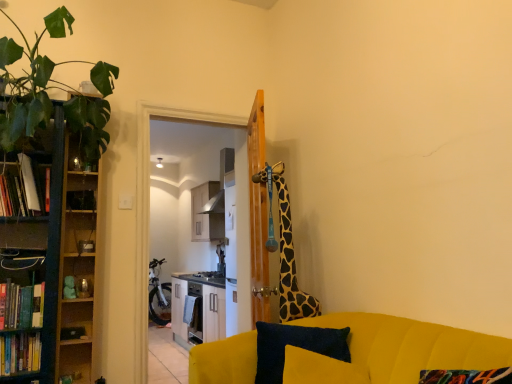
Question: Is wooden shelf at left next to hardcover book at left, the second book positioned from the bottom?

Choices:
 (A) no
 (B) yes

Answer: (A)

Question: Is there a large distance between wooden shelf at left and hardcover book at left, the 2th book positioned from the top?

Choices:
 (A) no
 (B) yes

Answer: (A)

Question: Is wooden shelf at left bigger than hardcover book at left, the 2th book positioned from the top?

Choices:
 (A) yes
 (B) no

Answer: (A)

Question: Is wooden shelf at left thinner than hardcover book at left, the 2th book positioned from the top?

Choices:
 (A) yes
 (B) no

Answer: (A)

Question: Is wooden shelf at left facing away from hardcover book at left, the 2th book positioned from the top?

Choices:
 (A) no
 (B) yes

Answer: (A)

Question: From the image's perspective, relative to hardcover book at left, the 2th book positioned from the top, is velvet dark blue pillow at lower center above or below?

Choices:
 (A) below
 (B) above

Answer: (A)

Question: Based on their sizes in the image, would you say velvet dark blue pillow at lower center is bigger or smaller than hardcover book at left, the 2th book positioned from the top?

Choices:
 (A) big
 (B) small

Answer: (A)

Question: Considering the positions of velvet dark blue pillow at lower center and hardcover book at left, the 2th book positioned from the top, in the image, is velvet dark blue pillow at lower center taller or shorter than hardcover book at left, the 2th book positioned from the top,?

Choices:
 (A) short
 (B) tall

Answer: (A)

Question: In the image, is velvet dark blue pillow at lower center positioned in front of or behind hardcover book at left, the 2th book positioned from the top?

Choices:
 (A) behind
 (B) front

Answer: (B)

Question: In terms of height, does white glossy cabinet at center look taller or shorter compared to green matte bookcase at left?

Choices:
 (A) short
 (B) tall

Answer: (A)

Question: Would you say white glossy cabinet at center is to the left or to the right of green matte bookcase at left in the picture?

Choices:
 (A) left
 (B) right

Answer: (B)

Question: From a real-world perspective, is white glossy cabinet at center physically located above or below green matte bookcase at left?

Choices:
 (A) below
 (B) above

Answer: (A)

Question: Looking at their shapes, would you say white glossy cabinet at center is wider or thinner than green matte bookcase at left?

Choices:
 (A) thin
 (B) wide

Answer: (B)

Question: Considering the positions of wooden shelf at left and hardcover book at left, the second book positioned from the bottom, in the image, is wooden shelf at left taller or shorter than hardcover book at left, the second book positioned from the bottom,?

Choices:
 (A) tall
 (B) short

Answer: (A)

Question: Is wooden shelf at left situated inside hardcover book at left, the 2th book positioned from the top, or outside?

Choices:
 (A) inside
 (B) outside

Answer: (B)